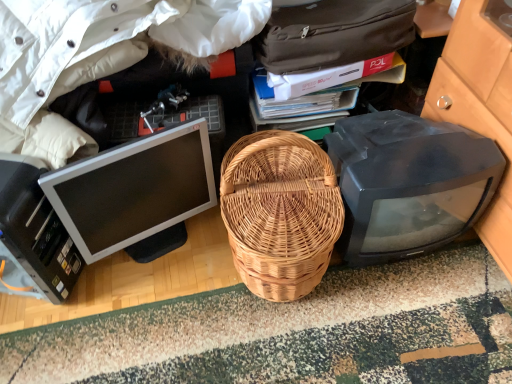
Where is `vacant space to the left of natural wicker picnic basket at center`? The image size is (512, 384). vacant space to the left of natural wicker picnic basket at center is located at coordinates (169, 291).